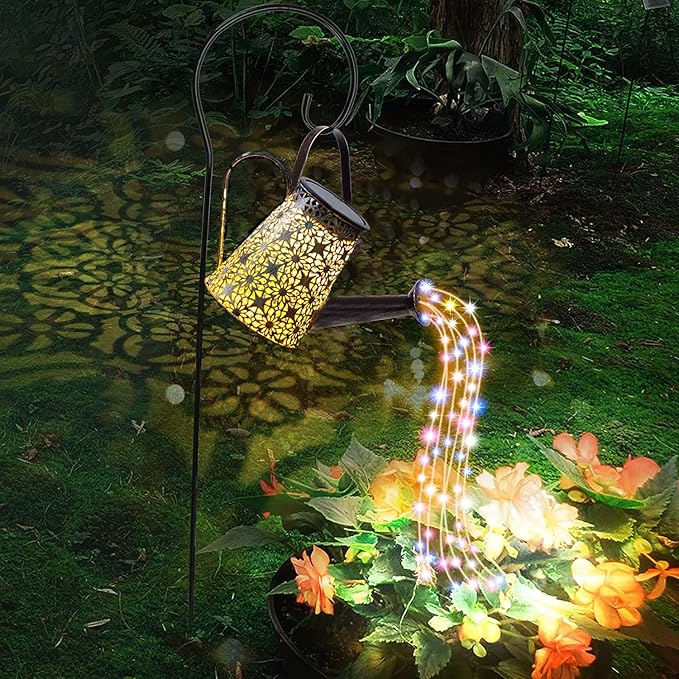
Locate an element on the screen. Image resolution: width=679 pixels, height=679 pixels. string lights is located at coordinates (464, 392).